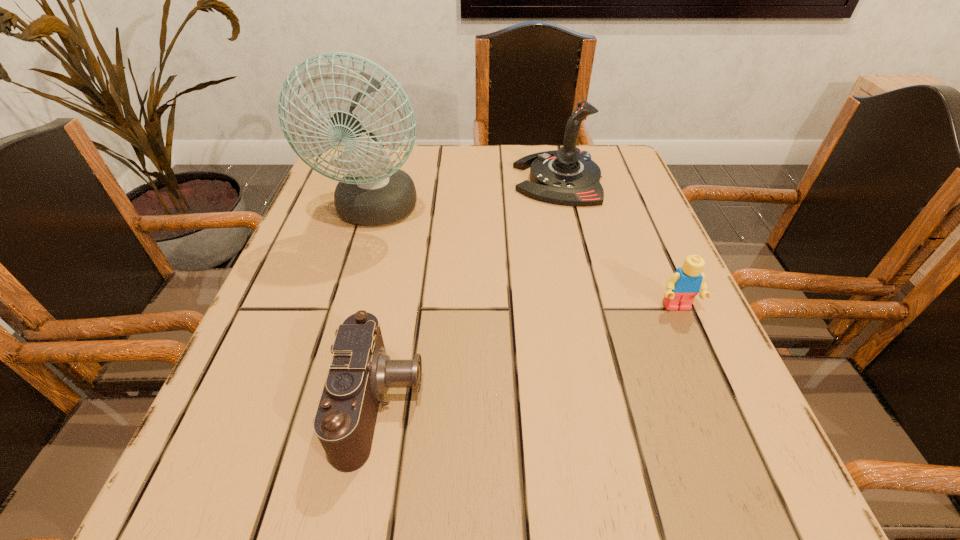
Where is `vacant space that satisfies the following two spatial constraints: 1. on the front-facing side of the rightmost object; 2. on the front-facing side of the camera`? The width and height of the screenshot is (960, 540). vacant space that satisfies the following two spatial constraints: 1. on the front-facing side of the rightmost object; 2. on the front-facing side of the camera is located at coordinates (718, 403).